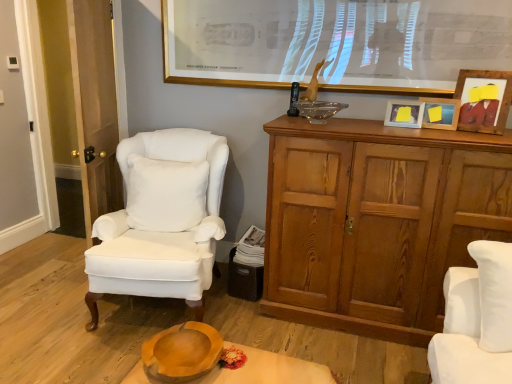
The image size is (512, 384). What are the coordinates of `free location in front of transparent glass door at left` in the screenshot? It's located at (52, 300).